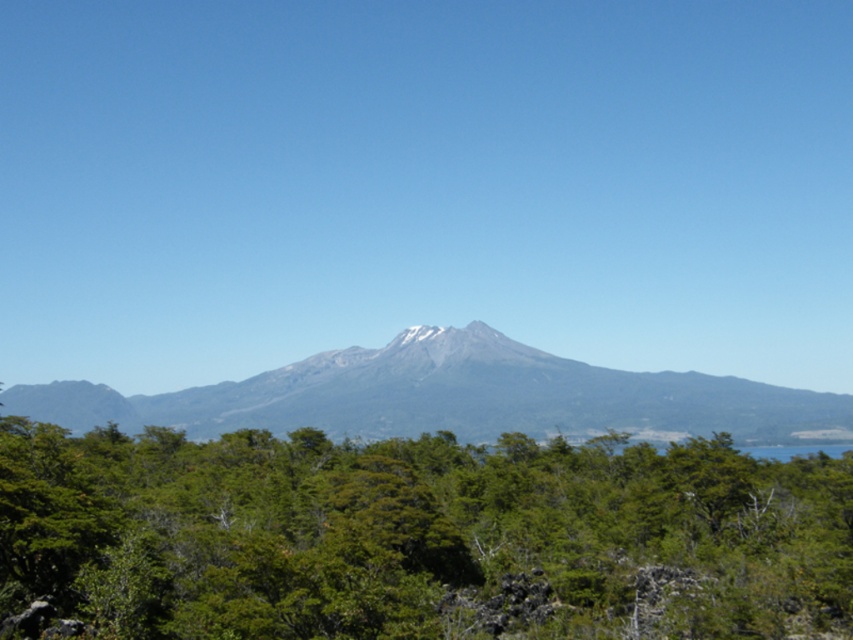
Is green leafy tree at center smaller than gray/rocky mountain at center?

Yes.

Can you confirm if green leafy tree at center is positioned below gray/rocky mountain at center?

No.

The image size is (853, 640). Describe the element at coordinates (415, 538) in the screenshot. I see `green leafy tree at center` at that location.

Locate an element on the screen. This screenshot has width=853, height=640. green leafy tree at center is located at coordinates (415, 538).